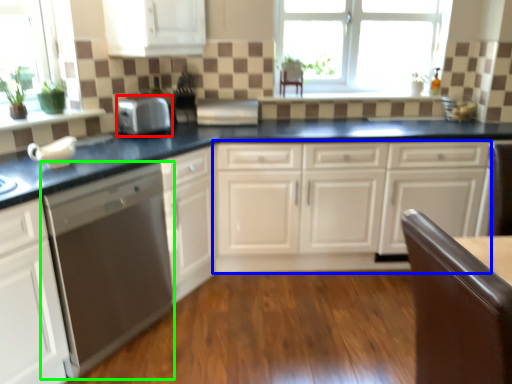
Question: Which is farther away from kitchen appliance (highlighted by a red box)? cabinetry (highlighted by a blue box) or home appliance (highlighted by a green box)?

Choices:
 (A) cabinetry
 (B) home appliance

Answer: (A)